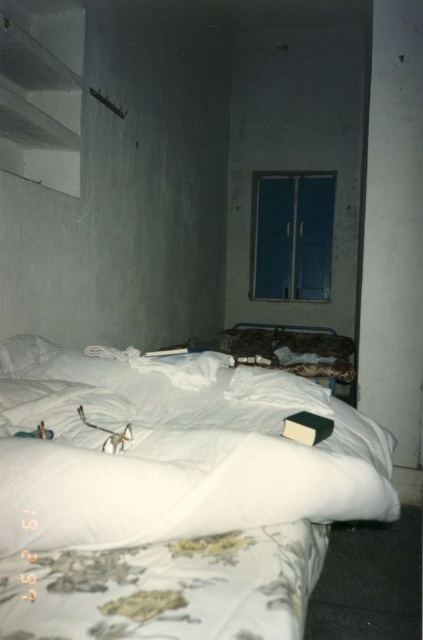
Question: Which point is closer to the camera?

Choices:
 (A) (189, 611)
 (B) (16, 364)

Answer: (A)

Question: Does white fabric bed at center have a greater width compared to white soft pillow at upper left?

Choices:
 (A) no
 (B) yes

Answer: (B)

Question: Among these points, which one is farthest from the camera?

Choices:
 (A) (285, 493)
 (B) (38, 344)

Answer: (B)

Question: Is white fabric bed at center closer to camera compared to white soft pillow at upper left?

Choices:
 (A) yes
 (B) no

Answer: (A)

Question: Can you confirm if white fabric bed at center is bigger than white soft pillow at upper left?

Choices:
 (A) yes
 (B) no

Answer: (A)